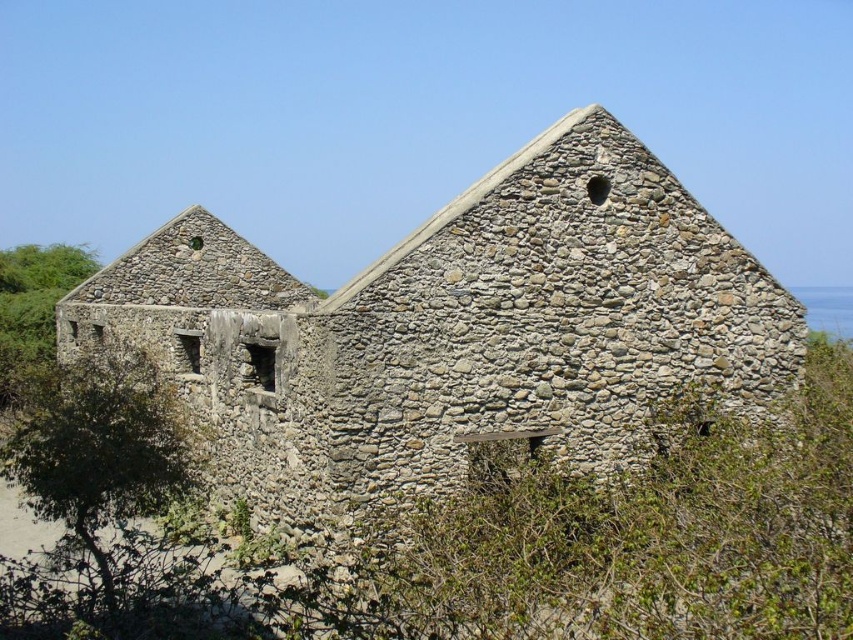
Question: Which point is farther from the camera taking this photo?

Choices:
 (A) pyautogui.click(x=496, y=200)
 (B) pyautogui.click(x=119, y=440)
 (C) pyautogui.click(x=828, y=621)

Answer: (A)

Question: Where is green leafy bush at center located in relation to green leafy tree at lower left in the image?

Choices:
 (A) left
 (B) right

Answer: (B)

Question: Which point is closer to the camera?

Choices:
 (A) green leafy bush at center
 (B) green leafy bush at left
 (C) green leafy tree at lower left

Answer: (A)

Question: Can you confirm if gray stone building at center is bigger than green leafy tree at lower left?

Choices:
 (A) no
 (B) yes

Answer: (B)

Question: Which is nearer to the green leafy tree at lower left?

Choices:
 (A) green leafy bush at center
 (B) green leafy bush at left

Answer: (A)

Question: Where is gray stone building at center located in relation to green leafy bush at center in the image?

Choices:
 (A) below
 (B) above

Answer: (B)